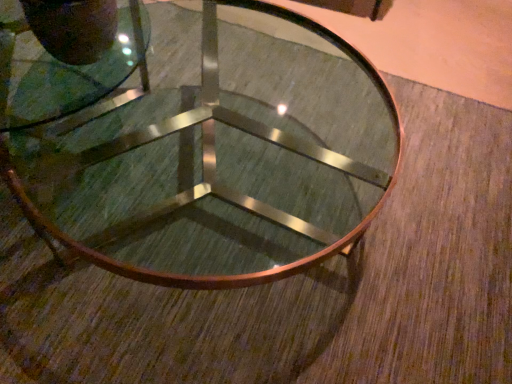
The image size is (512, 384). What do you see at coordinates (219, 155) in the screenshot? I see `transparent glass coffee table at center` at bounding box center [219, 155].

Find the location of `transparent glass coffee table at center`. transparent glass coffee table at center is located at coordinates (219, 155).

What is the approximate width of transparent glass coffee table at center?

transparent glass coffee table at center is 36.56 inches wide.

I want to click on transparent glass coffee table at center, so click(219, 155).